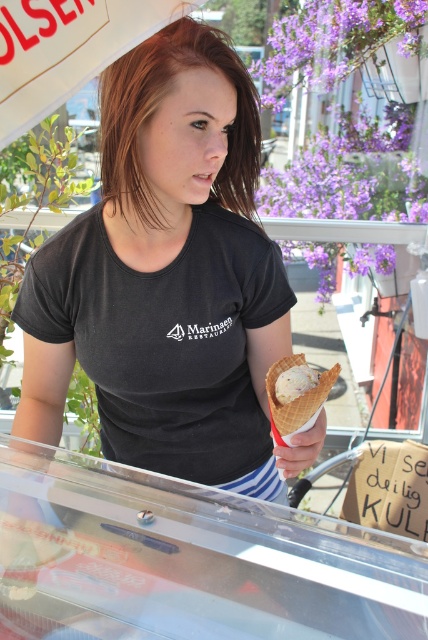
Does black matte t-shirt at center have a greater height compared to white creamy ice cream at center?

Yes.

Can you confirm if black matte t-shirt at center is positioned to the right of white creamy ice cream at center?

No, black matte t-shirt at center is not to the right of white creamy ice cream at center.

Is point (163, 97) in front of point (306, 365)?

No, it is not.

At what (x,y) coordinates should I click in order to perform the action: click on black matte t-shirt at center. Please return your answer as a coordinate pair (x, y). Image resolution: width=428 pixels, height=640 pixels. Looking at the image, I should click on (169, 278).

Is black matte t-shirt at center in front of vanilla ice cream in waffle cone at center?

No, black matte t-shirt at center is further to the viewer.

Can you confirm if black matte t-shirt at center is positioned to the right of vanilla ice cream in waffle cone at center?

No, black matte t-shirt at center is not to the right of vanilla ice cream in waffle cone at center.

Who is more forward, [68,236] or [279,403]?

Point [279,403] is more forward.

You are a GUI agent. You are given a task and a screenshot of the screen. Output one action in this format:
    pyautogui.click(x=<x>, y=<y>)
    Task: Click on the black matte t-shirt at center
    Image resolution: width=428 pixels, height=640 pixels.
    Given the screenshot: What is the action you would take?
    pyautogui.click(x=169, y=278)

Is vanilla ice cream in waffle cone at center shorter than white creamy ice cream at center?

No, vanilla ice cream in waffle cone at center is not shorter than white creamy ice cream at center.

The image size is (428, 640). What do you see at coordinates (297, 397) in the screenshot? I see `vanilla ice cream in waffle cone at center` at bounding box center [297, 397].

Locate an element on the screen. This screenshot has height=640, width=428. vanilla ice cream in waffle cone at center is located at coordinates (297, 397).

The image size is (428, 640). I want to click on vanilla ice cream in waffle cone at center, so click(x=297, y=397).